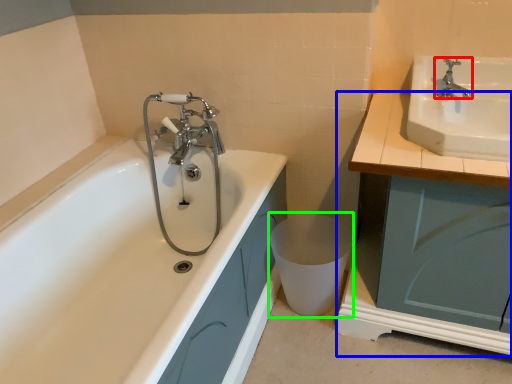
Question: Considering the real-world distances, which object is closest to tap (highlighted by a red box)? cabinetry (highlighted by a blue box) or toilet bowl (highlighted by a green box).

Choices:
 (A) cabinetry
 (B) toilet bowl

Answer: (A)